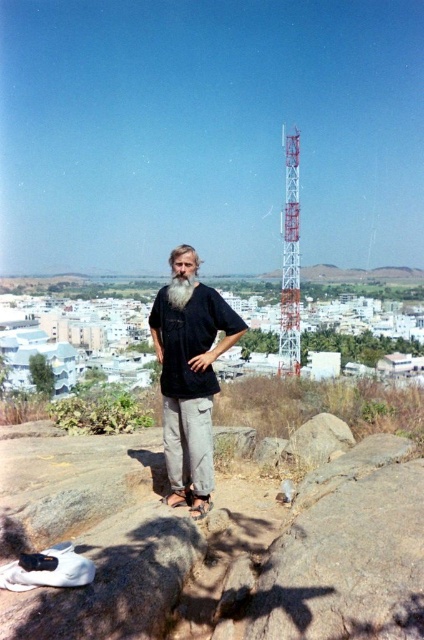
Question: Which of these objects is positioned closest to the brown rough rock at center?

Choices:
 (A) smooth gray rock at center
 (B) white soft beard at center
 (C) black matte shirt at center

Answer: (A)

Question: Which object is the closest to the white soft beard at center?

Choices:
 (A) black matte shirt at center
 (B) brown rough rock at center
 (C) smooth gray rock at center

Answer: (A)

Question: Where is smooth gray rock at center located in relation to white soft beard at center in the image?

Choices:
 (A) right
 (B) left

Answer: (A)

Question: Where is smooth gray rock at center located in relation to white soft beard at center in the image?

Choices:
 (A) right
 (B) left

Answer: (A)

Question: From the image, what is the correct spatial relationship of smooth gray rock at center in relation to white soft beard at center?

Choices:
 (A) above
 (B) below

Answer: (B)

Question: Which object is positioned farthest from the white soft beard at center?

Choices:
 (A) smooth gray rock at center
 (B) brown rough rock at center
 (C) black matte shirt at center

Answer: (B)